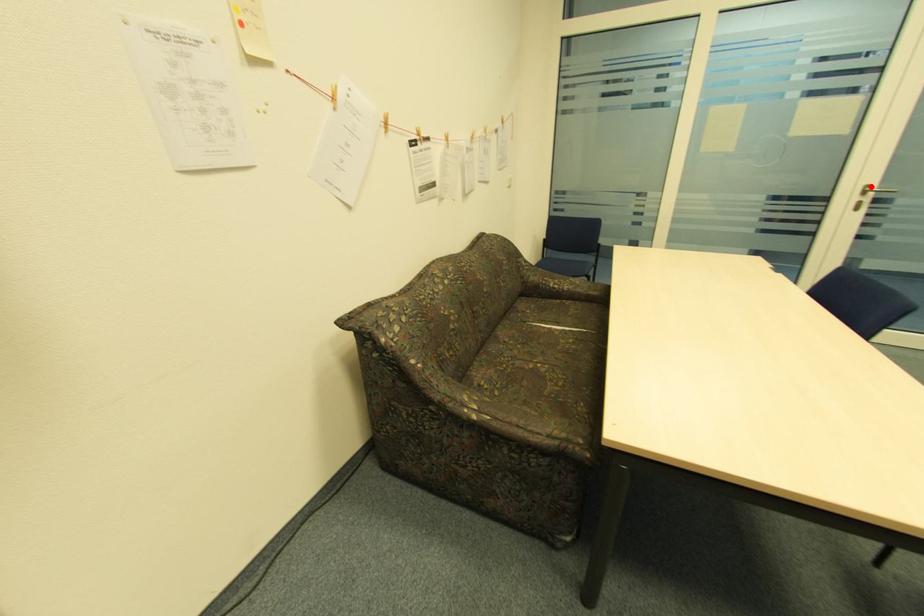
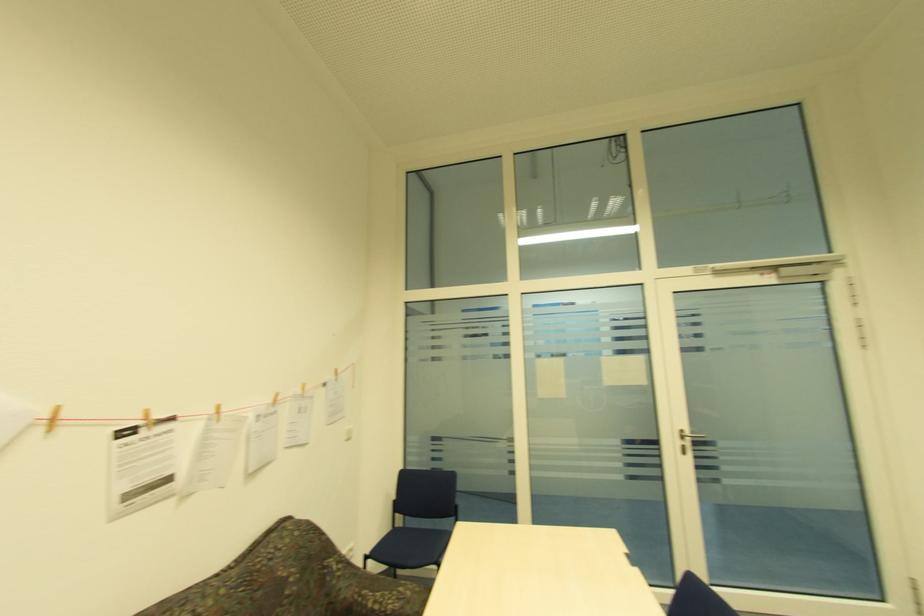
The point at the highlighted location is marked in the first image. Where is the corresponding point in the second image?

(685, 432)